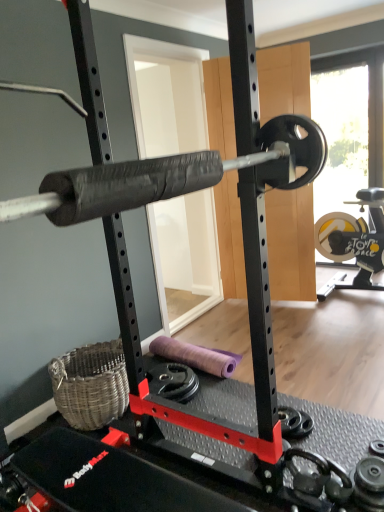
Identify the location of free spot to the right of black rubber dumbbell at lower right. The image size is (384, 512). (329, 423).